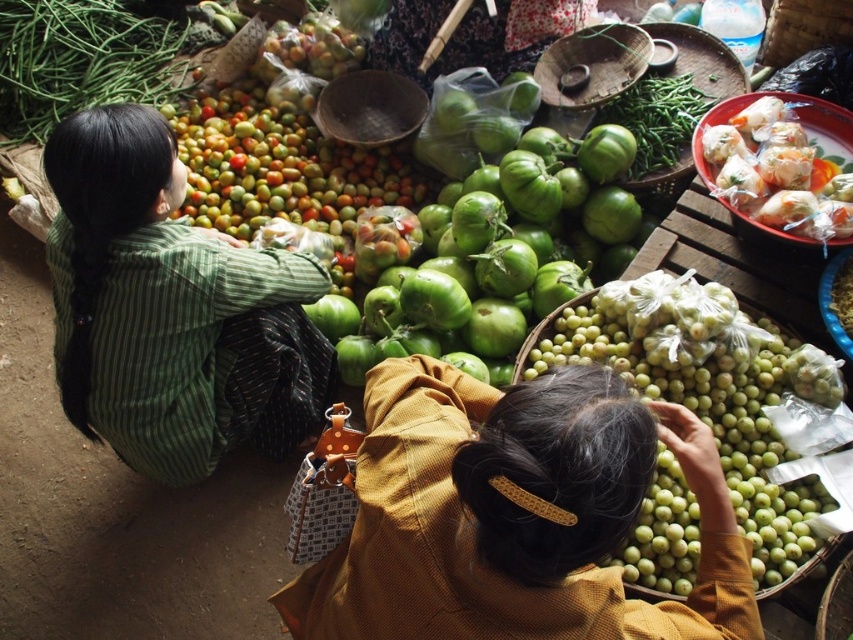
You are a photographer setting up a shot at the market. You need to ensure that the green striped shirt at left and the translucent plastic rolls at upper right are both in frame. Given that your camera has a fixed focal length, which object should you position closer to the camera to maintain their relative sizes as seen in the original scene?

The green striped shirt at left is wider than the translucent plastic rolls at upper right. To maintain their relative sizes, you should position the translucent plastic rolls at upper right closer to the camera since they are narrower and need to appear proportionally smaller in the frame compared to the green striped shirt at left.

You are a photographer trying to capture the market scene. You notice two points in the image at coordinates point (312, 156) and point (76, 29). If you want to focus on the point that is closer to you, which coordinate should you adjust your camera to?

Point (312, 156) is closer to the camera than point (76, 29), so you should adjust your camera to focus on point (312, 156).

You are a delivery robot with a 1.2 meter width. You need to navigate through the market scene to deliver a package. Can you pass between the matte yellow shirt at lower center and the green string beans at upper left without touching either?

The matte yellow shirt at lower center might be wider than green string beans at upper left, but the exact distance isn not specified. Without knowing the actual width between them, it is uncertain if the robot can safely pass through.